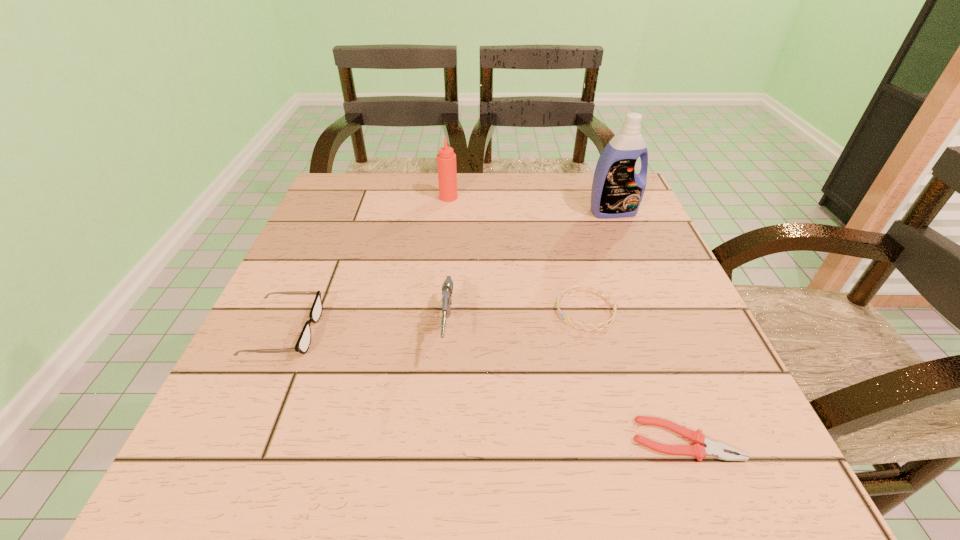
Where is `object that is at the near edge`? This screenshot has height=540, width=960. object that is at the near edge is located at coordinates (716, 449).

The height and width of the screenshot is (540, 960). I want to click on object at the left edge, so click(x=303, y=343).

Locate an element on the screen. detergent positioned at the right edge is located at coordinates (617, 191).

You are a GUI agent. You are given a task and a screenshot of the screen. Output one action in this format:
    pyautogui.click(x=<x>, y=<y>)
    Task: Click on the bracelet present at the right edge
    This screenshot has width=960, height=540.
    Given the screenshot: What is the action you would take?
    pyautogui.click(x=568, y=290)

At what (x,y) coordinates should I click in order to perform the action: click on pliers located in the right edge section of the desktop. Please return your answer as a coordinate pair (x, y). Image resolution: width=960 pixels, height=540 pixels. Looking at the image, I should click on [x=716, y=449].

The width and height of the screenshot is (960, 540). I want to click on object at the far right corner, so click(617, 191).

The image size is (960, 540). I want to click on object at the near right corner, so click(x=716, y=449).

Where is `vacant space at the far edge`? The image size is (960, 540). vacant space at the far edge is located at coordinates (486, 173).

Identify the location of free space at the near edge of the desktop. The width and height of the screenshot is (960, 540). (605, 491).

Locate an element on the screen. free space at the left edge of the desktop is located at coordinates (371, 249).